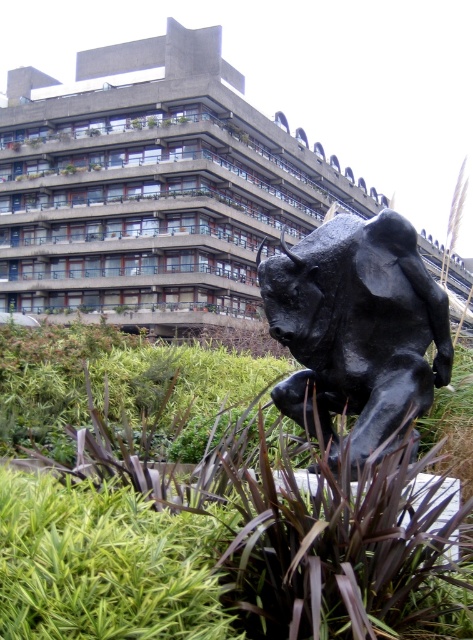
Question: Does concrete building at center have a greater width compared to black polished bull at center?

Choices:
 (A) no
 (B) yes

Answer: (B)

Question: Is concrete building at center further to camera compared to black polished bull at center?

Choices:
 (A) no
 (B) yes

Answer: (B)

Question: In this image, where is concrete building at center located relative to black polished bull at center?

Choices:
 (A) above
 (B) below

Answer: (A)